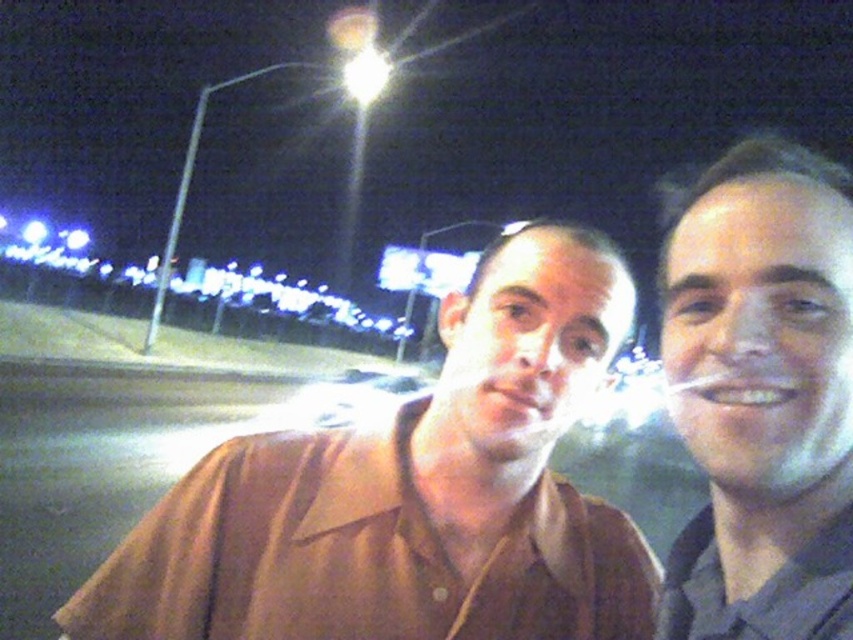
Is point (363, 492) positioned before point (757, 212)?

No, (363, 492) is further to viewer.

Is brown shirt at center bigger than gray matte face at right?

Yes, brown shirt at center is bigger than gray matte face at right.

Is point (323, 525) positioned before point (740, 272)?

No.

Where is `brown shirt at center`? The width and height of the screenshot is (853, 640). brown shirt at center is located at coordinates (412, 493).